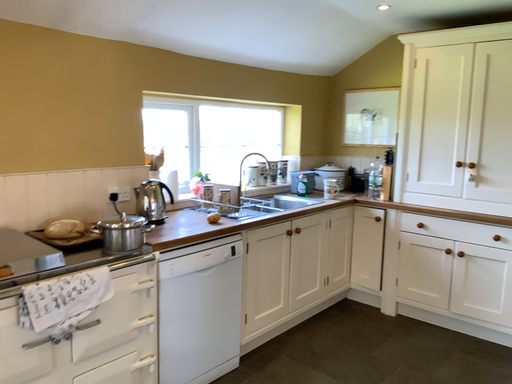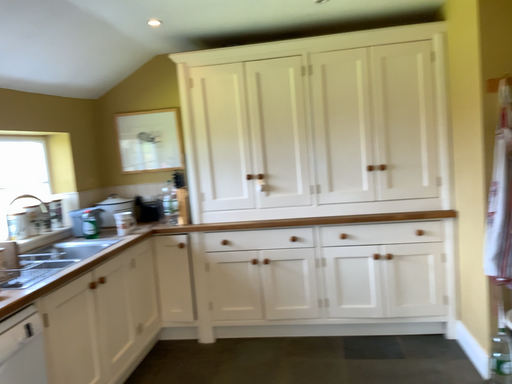
Question: Which way did the camera rotate in the video?

Choices:
 (A) rotated downward
 (B) rotated upward

Answer: (B)